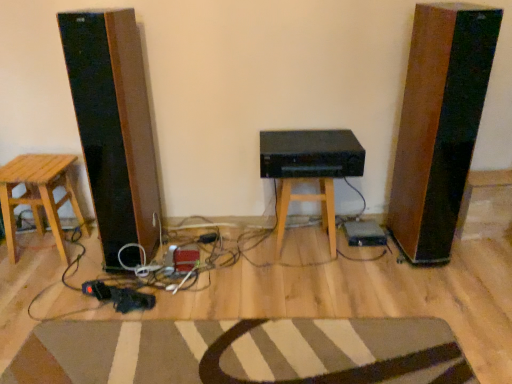
Where is `vacant area situated to the left side of wooden stool at center, the second stool when ordered from left to right`? This screenshot has height=384, width=512. vacant area situated to the left side of wooden stool at center, the second stool when ordered from left to right is located at coordinates (246, 250).